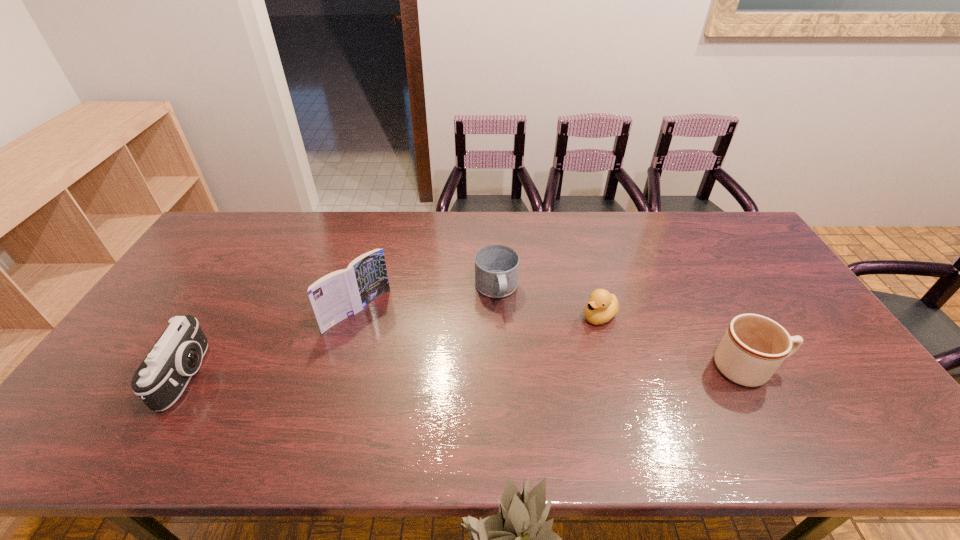
You are a GUI agent. You are given a task and a screenshot of the screen. Output one action in this format:
    pyautogui.click(x=<x>, y=<y>)
    Task: Click on the mug located in the near edge section of the desktop
    The width and height of the screenshot is (960, 540).
    Given the screenshot: What is the action you would take?
    pyautogui.click(x=753, y=347)

Find the location of `blank space at the far edge of the desktop`. blank space at the far edge of the desktop is located at coordinates (276, 211).

This screenshot has height=540, width=960. In the image, there is a desktop. Identify the location of vacant space at the near edge. (782, 396).

Image resolution: width=960 pixels, height=540 pixels. What are the coordinates of `vacant position at the right edge of the desktop` in the screenshot? It's located at (760, 260).

This screenshot has height=540, width=960. In order to click on vacant area at the far left corner of the desktop in this screenshot , I will do `click(251, 227)`.

Find the location of `vacant space at the far right corner of the desktop`. vacant space at the far right corner of the desktop is located at coordinates (731, 249).

Identify the location of free space at the near right corner of the desktop. (872, 406).

Where is `free space between the tallest object and the duckling`? The height and width of the screenshot is (540, 960). free space between the tallest object and the duckling is located at coordinates (478, 313).

Find the location of a particular element. The height and width of the screenshot is (540, 960). empty space between the right mug and the fourth object from left to right is located at coordinates (674, 342).

Locate an element on the screen. Image resolution: width=960 pixels, height=540 pixels. empty location between the book and the fourth object from left to right is located at coordinates (478, 313).